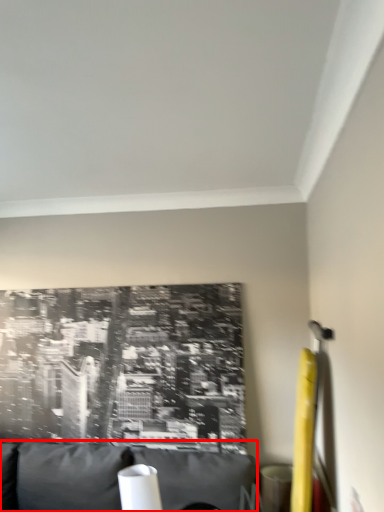
Question: Where is furniture (annotated by the red box) located in relation to table lamp in the image?

Choices:
 (A) right
 (B) left

Answer: (B)